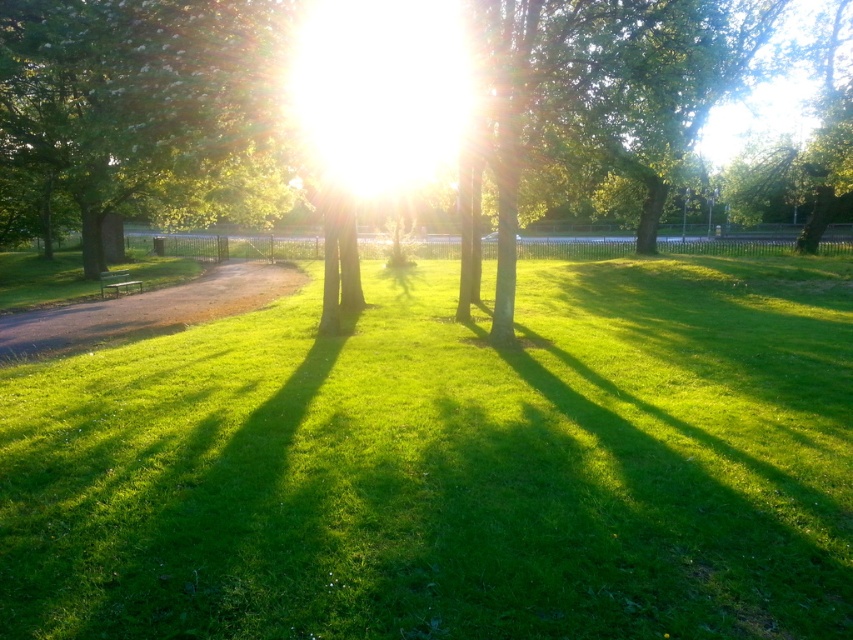
You are standing at point [450,465] in the park scene. What is the terrain like at that location?

The terrain at point [450,465] is green grassy at center.

In the scene shown: You are standing in the park and want to find the tallest tree between the green leafy tree at center and the green leafy tree at left. Which one should you look towards?

The green leafy tree at center is taller than the green leafy tree at left, so you should look towards the center to find the tallest tree.

You are standing in the park and want to take a photo of both the green leafy tree at center and the green leafy tree at left. Which tree should you stand closer to in order to include both in your photo without moving the camera?

You should stand closer to the green leafy tree at left because the green leafy tree at center is positioned on the right side of the green leafy tree at left, so positioning yourself near the left tree will help frame both within the camera view.